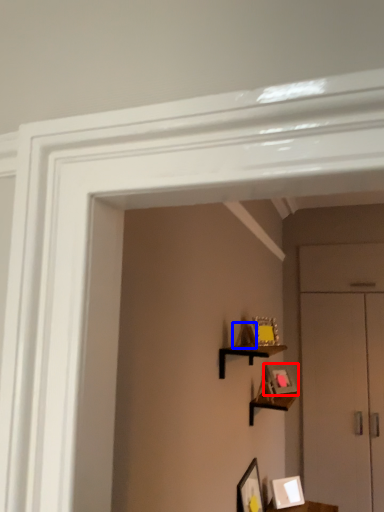
Question: Which object is further to the camera taking this photo, picture frame (highlighted by a red box) or picture frame (highlighted by a blue box)?

Choices:
 (A) picture frame
 (B) picture frame

Answer: (A)